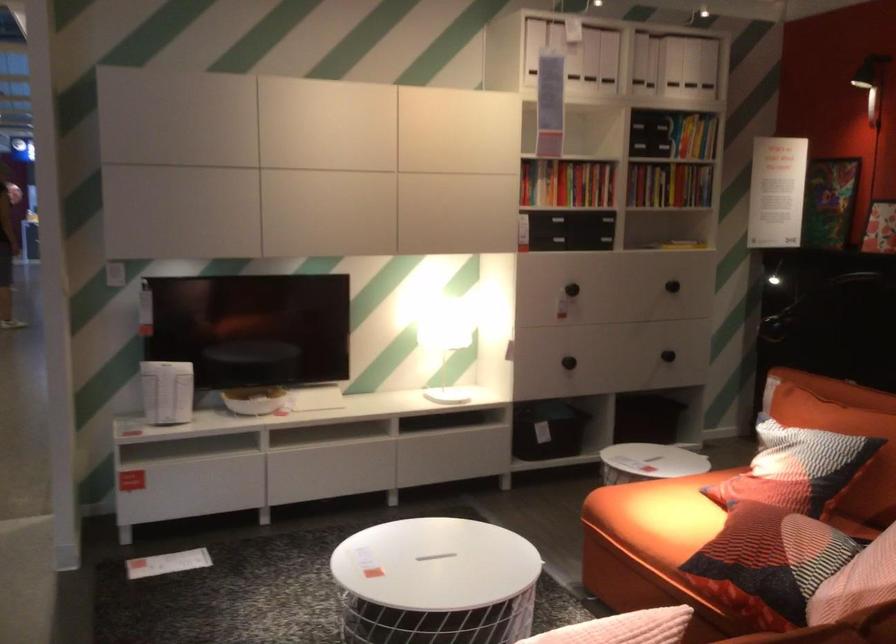
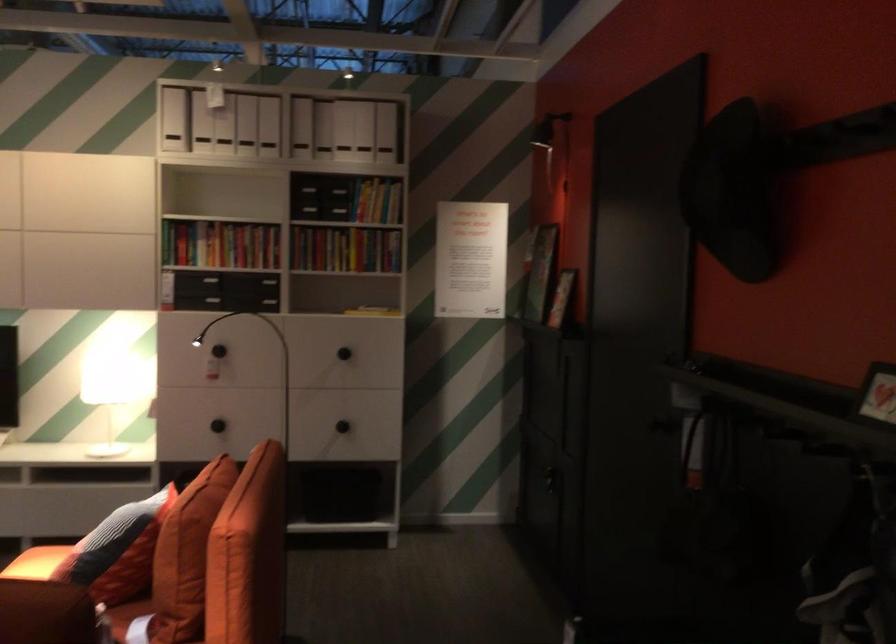
The point at (x=615, y=275) is marked in the first image. Where is the corresponding point in the second image?

(218, 351)